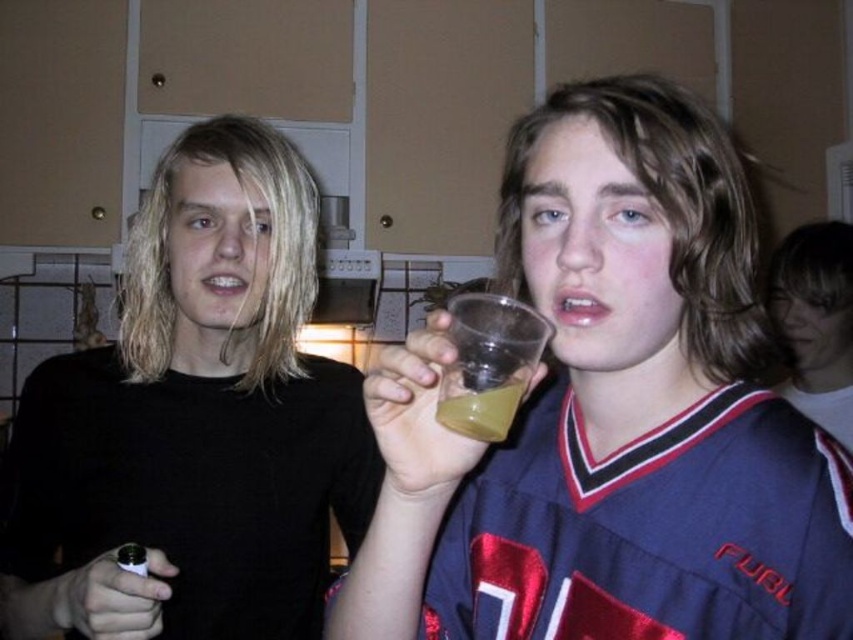
Does transparent plastic cup at center come in front of black matte shirt at left?

Yes, transparent plastic cup at center is in front of black matte shirt at left.

Consider the image. Which is more to the left, transparent plastic cup at center or black matte shirt at left?

black matte shirt at left is more to the left.

Describe the element at coordinates (611, 413) in the screenshot. I see `transparent plastic cup at center` at that location.

At what (x,y) coordinates should I click in order to perform the action: click on transparent plastic cup at center. Please return your answer as a coordinate pair (x, y). This screenshot has width=853, height=640. Looking at the image, I should click on (611, 413).

Between transparent plastic cup at center and blue jersey at center, which one has more height?

With more height is blue jersey at center.

Consider the image. Is transparent plastic cup at center bigger than blue jersey at center?

Correct, transparent plastic cup at center is larger in size than blue jersey at center.

Locate an element on the screen. This screenshot has height=640, width=853. transparent plastic cup at center is located at coordinates (611, 413).

Does black matte shirt at left come in front of blue jersey at center?

Yes, it is in front of blue jersey at center.

Is point (178, 184) closer to camera compared to point (849, 394)?

Yes.

The image size is (853, 640). Identify the location of black matte shirt at left. (194, 420).